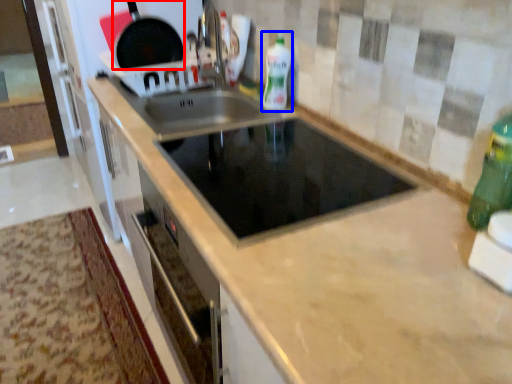
Question: Which of the following is the closest to the observer, frying pan (highlighted by a red box) or bottle (highlighted by a blue box)?

Choices:
 (A) frying pan
 (B) bottle

Answer: (B)